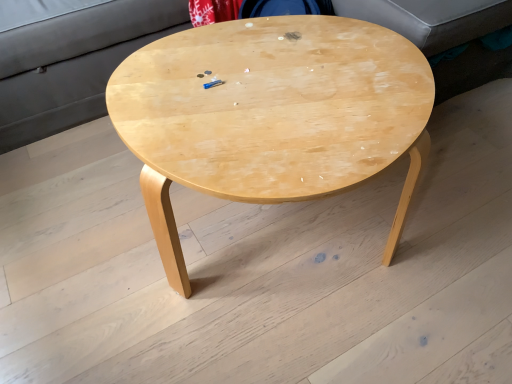
Describe the element at coordinates (270, 115) in the screenshot. The height and width of the screenshot is (384, 512). I see `natural wood coffee table at center` at that location.

This screenshot has width=512, height=384. I want to click on natural wood coffee table at center, so click(270, 115).

Image resolution: width=512 pixels, height=384 pixels. In order to click on natural wood coffee table at center in this screenshot , I will do coord(270,115).